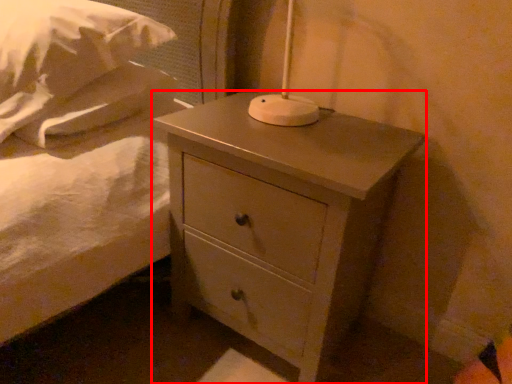
Question: From the image's perspective, where is nightstand (annotated by the red box) located relative to pillow?

Choices:
 (A) above
 (B) below

Answer: (B)